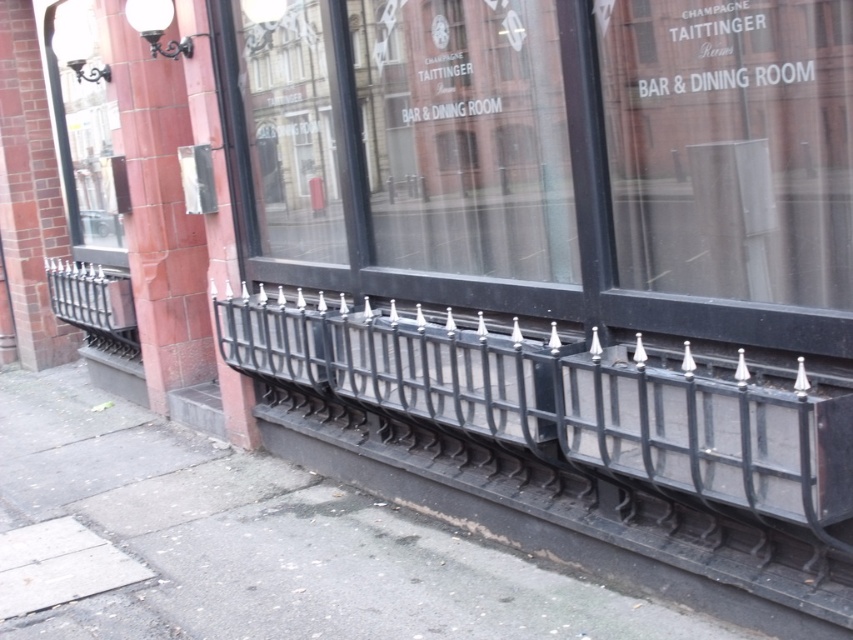
Consider the image. You are standing in front of the building and want to take a photo of the TAITTINGER sign on the window. Where should you position yourself relative to the black wrought iron fence at lower center to ensure the sign is fully visible in your camera frame?

To ensure the TAITTINGER sign on the window is fully visible, you should position yourself in front of the black wrought iron fence at lower center since the fence is located at lower center, which is below the window. This placement allows an unobstructed view of the upper window area where the sign is displayed.

You are a delivery person trying to enter the building through the entrance near the black wrought iron fence at lower center. The entrance is partially blocked by the matte glass window at upper left. Can you walk through the space between them?

The black wrought iron fence at lower center is positioned under the matte glass window at upper left, so there is vertical space between them. Since the fence is lower and the window is above, you can walk through the space between them as they are not blocking the entrance horizontally.